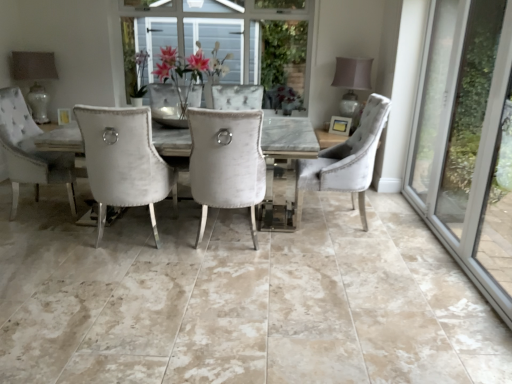
What are the coordinates of `vacant space to the left of velvet white chair at center, marked as the 2th chair in a right-to-left arrangement` in the screenshot? It's located at coord(156,240).